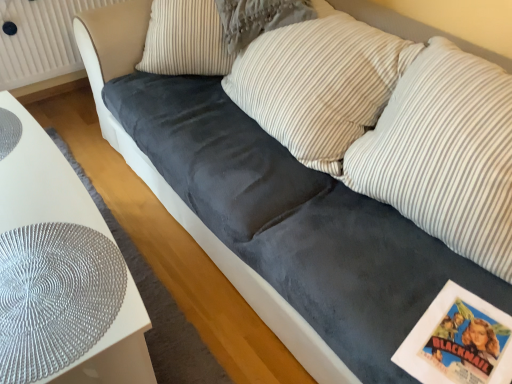
What do you see at coordinates (60, 271) in the screenshot? The height and width of the screenshot is (384, 512). I see `white glossy table at lower left` at bounding box center [60, 271].

Where is `striped fabric pillow at center, placed as the 3th pillow when sorted from right to left`? This screenshot has width=512, height=384. striped fabric pillow at center, placed as the 3th pillow when sorted from right to left is located at coordinates (258, 19).

I want to click on white striped pillow at center, positioned as the second pillow in right-to-left order, so click(319, 83).

In order to face velvet gray pillow at center, placed as the first pillow when sorted from left to right, should I rotate leftwards or rightwards?

Rotate your view left by about 5.112°.

This screenshot has height=384, width=512. Describe the element at coordinates (184, 39) in the screenshot. I see `velvet gray pillow at center, placed as the first pillow when sorted from left to right` at that location.

Measure the distance between white textured radiator at upper left and camera.

The distance of white textured radiator at upper left from camera is 1.86 meters.

The height and width of the screenshot is (384, 512). In order to click on white textured radiator at upper left in this screenshot , I will do `click(40, 40)`.

Where is `white glossy table at lower left`? white glossy table at lower left is located at coordinates (60, 271).

Can you tell me how much striped fabric pillow at center, arranged as the fourth pillow when viewed from the left, and white textured radiator at upper left differ in facing direction?

90.5 degrees.

Which is behind, point (464, 170) or point (31, 51)?

The point (31, 51) is behind.

Consider the image. Is striped fabric pillow at center, which is counted as the first pillow, starting from the right, closer to camera compared to white textured radiator at upper left?

Yes, it is.

Does striped fabric pillow at center, which is counted as the first pillow, starting from the right, turn towards white textured radiator at upper left?

No.

Which is nearer, (165, 4) or (288, 18)?

Point (165, 4) is farther from the camera than point (288, 18).

Measure the distance from velvet gray pillow at center, which is the 4th pillow from right to left, to striped fabric pillow at center, the 2th pillow when ordered from left to right.

velvet gray pillow at center, which is the 4th pillow from right to left, is 7.43 inches from striped fabric pillow at center, the 2th pillow when ordered from left to right.

What's the angular difference between velvet gray pillow at center, placed as the first pillow when sorted from left to right, and striped fabric pillow at center, placed as the 3th pillow when sorted from right to left,'s facing directions?

The angular difference between velvet gray pillow at center, placed as the first pillow when sorted from left to right, and striped fabric pillow at center, placed as the 3th pillow when sorted from right to left, is 3.95e-05 degrees.

Can you confirm if velvet gray pillow at center, which is the 4th pillow from right to left, is taller than striped fabric pillow at center, placed as the 3th pillow when sorted from right to left?

Correct, velvet gray pillow at center, which is the 4th pillow from right to left, is much taller as striped fabric pillow at center, placed as the 3th pillow when sorted from right to left.

Can you tell me how much white textured radiator at upper left and white striped pillow at center, acting as the 3th pillow starting from the left, differ in facing direction?

90.5 degrees.

From the image's perspective, is white textured radiator at upper left positioned above or below white striped pillow at center, acting as the 3th pillow starting from the left?

Based on their image positions, white textured radiator at upper left is located above white striped pillow at center, acting as the 3th pillow starting from the left.

Considering the positions of objects white textured radiator at upper left and white striped pillow at center, positioned as the second pillow in right-to-left order, in the image provided, who is more to the left, white textured radiator at upper left or white striped pillow at center, positioned as the second pillow in right-to-left order,?

From the viewer's perspective, white textured radiator at upper left appears more on the left side.

From a real-world perspective, is striped fabric pillow at center, placed as the 3th pillow when sorted from right to left, on white striped pillow at center, positioned as the second pillow in right-to-left order?

Yes, from a real-world perspective, striped fabric pillow at center, placed as the 3th pillow when sorted from right to left, is above white striped pillow at center, positioned as the second pillow in right-to-left order.

I want to click on pillow that is the 1st object located above the white striped pillow at center, acting as the 3th pillow starting from the left (from the image's perspective), so click(258, 19).

Is striped fabric pillow at center, the 2th pillow when ordered from left to right, looking in the opposite direction of white striped pillow at center, positioned as the second pillow in right-to-left order?

That's right, striped fabric pillow at center, the 2th pillow when ordered from left to right, is facing away from white striped pillow at center, positioned as the second pillow in right-to-left order.

Which of these two, white striped pillow at center, positioned as the second pillow in right-to-left order, or velvet gray pillow at center, which is the 4th pillow from right to left, is wider?

Wider between the two is velvet gray pillow at center, which is the 4th pillow from right to left.

Who is taller, white striped pillow at center, acting as the 3th pillow starting from the left, or velvet gray pillow at center, which is the 4th pillow from right to left?

white striped pillow at center, acting as the 3th pillow starting from the left.

Considering the positions of points (311, 89) and (200, 19), is point (311, 89) farther from camera compared to point (200, 19)?

No, it is in front of (200, 19).

Looking at this image, considering the sizes of white striped pillow at center, acting as the 3th pillow starting from the left, and velvet gray pillow at center, which is the 4th pillow from right to left, in the image, is white striped pillow at center, acting as the 3th pillow starting from the left, bigger or smaller than velvet gray pillow at center, which is the 4th pillow from right to left,?

In the image, white striped pillow at center, acting as the 3th pillow starting from the left, appears to be larger than velvet gray pillow at center, which is the 4th pillow from right to left.

Consider the image. Can you confirm if striped fabric pillow at center, placed as the 3th pillow when sorted from right to left, is smaller than white textured radiator at upper left?

Actually, striped fabric pillow at center, placed as the 3th pillow when sorted from right to left, might be larger than white textured radiator at upper left.

Does striped fabric pillow at center, the 2th pillow when ordered from left to right, appear on the right side of white textured radiator at upper left?

Yes.

Considering the points (242, 16) and (70, 11), which point is behind, point (242, 16) or point (70, 11)?

The point (70, 11) is more distant.

Would you consider striped fabric pillow at center, placed as the 3th pillow when sorted from right to left, to be distant from white textured radiator at upper left?

Yes.

Does white glossy table at lower left have a larger size compared to striped fabric pillow at center, which is counted as the first pillow, starting from the right?

Indeed, white glossy table at lower left has a larger size compared to striped fabric pillow at center, which is counted as the first pillow, starting from the right.

Is white glossy table at lower left to the right of striped fabric pillow at center, arranged as the fourth pillow when viewed from the left, from the viewer's perspective?

Incorrect, white glossy table at lower left is not on the right side of striped fabric pillow at center, arranged as the fourth pillow when viewed from the left.

Is white glossy table at lower left positioned far away from striped fabric pillow at center, arranged as the fourth pillow when viewed from the left?

No, white glossy table at lower left is not far away from striped fabric pillow at center, arranged as the fourth pillow when viewed from the left.

Identify the location of furniture located on the left of striped fabric pillow at center, arranged as the fourth pillow when viewed from the left. This screenshot has height=384, width=512. (60, 271).

This screenshot has height=384, width=512. Identify the location of radiator above the striped fabric pillow at center, which is counted as the first pillow, starting from the right (from the image's perspective). (40, 40).

Identify the location of pillow behind the striped fabric pillow at center, the 2th pillow when ordered from left to right. (184, 39).

Which object lies nearer to the anchor point white glossy table at lower left, striped fabric pillow at center, the 2th pillow when ordered from left to right, or velvet gray pillow at center, which is the 4th pillow from right to left?

velvet gray pillow at center, which is the 4th pillow from right to left.

Which object lies nearer to the anchor point white textured radiator at upper left, white striped pillow at center, acting as the 3th pillow starting from the left, or velvet gray pillow at center, placed as the first pillow when sorted from left to right?

velvet gray pillow at center, placed as the first pillow when sorted from left to right, is positioned closer to the anchor white textured radiator at upper left.

Considering their positions, is white striped pillow at center, acting as the 3th pillow starting from the left, positioned closer to velvet gray pillow at center, which is the 4th pillow from right to left, than white glossy table at lower left?

white striped pillow at center, acting as the 3th pillow starting from the left, lies closer to velvet gray pillow at center, which is the 4th pillow from right to left, than the other object.

When comparing their distances from white glossy table at lower left, does velvet gray pillow at center, which is the 4th pillow from right to left, or white textured radiator at upper left seem further?

white textured radiator at upper left is positioned further to the anchor white glossy table at lower left.

When comparing their distances from striped fabric pillow at center, which is counted as the first pillow, starting from the right, does striped fabric pillow at center, placed as the 3th pillow when sorted from right to left, or velvet gray pillow at center, placed as the first pillow when sorted from left to right, seem closer?

Among the two, striped fabric pillow at center, placed as the 3th pillow when sorted from right to left, is located nearer to striped fabric pillow at center, which is counted as the first pillow, starting from the right.

Estimate the real-world distances between objects in this image. Which object is further from white striped pillow at center, acting as the 3th pillow starting from the left, white glossy table at lower left or striped fabric pillow at center, arranged as the fourth pillow when viewed from the left?

white glossy table at lower left.

Considering their positions, is striped fabric pillow at center, the 2th pillow when ordered from left to right, positioned closer to white glossy table at lower left than white striped pillow at center, positioned as the second pillow in right-to-left order?

Among the two, white striped pillow at center, positioned as the second pillow in right-to-left order, is located nearer to white glossy table at lower left.

From the picture: Based on their spatial positions, is white striped pillow at center, positioned as the second pillow in right-to-left order, or striped fabric pillow at center, arranged as the fourth pillow when viewed from the left, further from white glossy table at lower left?

striped fabric pillow at center, arranged as the fourth pillow when viewed from the left, is positioned further to the anchor white glossy table at lower left.

Locate an element on the screen. The image size is (512, 384). furniture between white textured radiator at upper left and striped fabric pillow at center, which is counted as the first pillow, starting from the right is located at coordinates (60, 271).

The width and height of the screenshot is (512, 384). I want to click on pillow located between white textured radiator at upper left and striped fabric pillow at center, placed as the 3th pillow when sorted from right to left, in the left-right direction, so click(x=184, y=39).

You are a GUI agent. You are given a task and a screenshot of the screen. Output one action in this format:
    pyautogui.click(x=<x>, y=<y>)
    Task: Click on the furniture situated between white textured radiator at upper left and white striped pillow at center, positioned as the second pillow in right-to-left order, from left to right
    This screenshot has height=384, width=512.
    Given the screenshot: What is the action you would take?
    pyautogui.click(x=60, y=271)

At what (x,y) coordinates should I click in order to perform the action: click on pillow between white striped pillow at center, positioned as the second pillow in right-to-left order, and velvet gray pillow at center, which is the 4th pillow from right to left, along the z-axis. Please return your answer as a coordinate pair (x, y). Image resolution: width=512 pixels, height=384 pixels. Looking at the image, I should click on (258, 19).